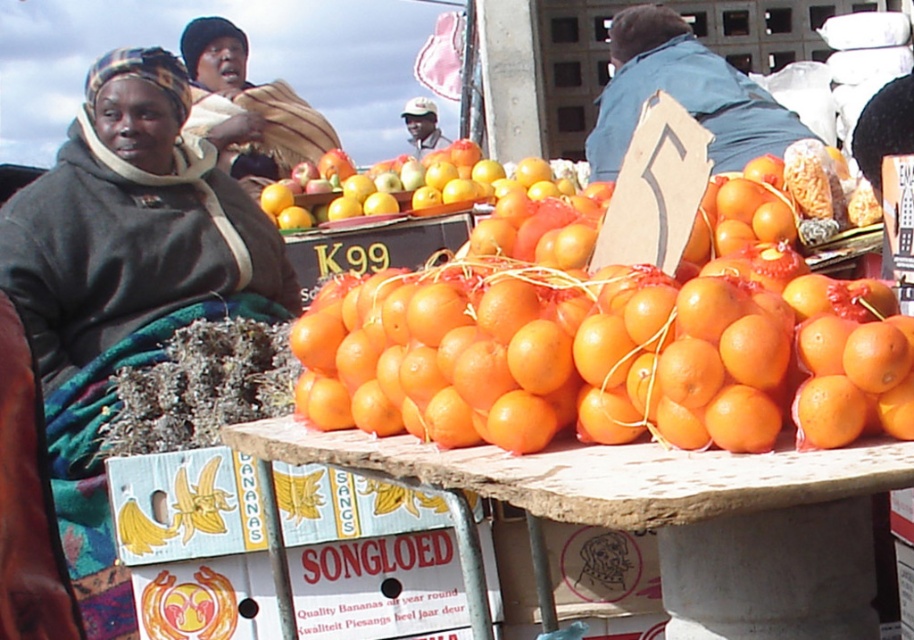
Question: Which object is farther from the camera taking this photo?

Choices:
 (A) smooth wooden table at center
 (B) glossy orange at center

Answer: (B)

Question: Which of the following is the closest to the observer?

Choices:
 (A) (466, 204)
 (B) (442, 330)
 (C) (558, 339)
 (D) (579, 445)

Answer: (C)

Question: Is smooth wooden table at center behind shiny orange oranges at center?

Choices:
 (A) no
 (B) yes

Answer: (A)

Question: Which point appears closest to the camera in this image?

Choices:
 (A) (626, 72)
 (B) (792, 474)
 (C) (695, 342)

Answer: (B)

Question: Does smooth wooden table at center have a lesser width compared to glossy orange at center?

Choices:
 (A) yes
 (B) no

Answer: (B)

Question: Is orange matte at center positioned behind blue denim jacket at upper center?

Choices:
 (A) yes
 (B) no

Answer: (B)